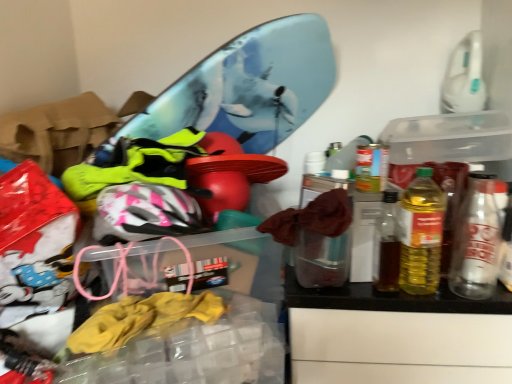
This screenshot has width=512, height=384. What are the coordinates of `yellow translucent bottle at right, marked as the 1th bottle in a left-to-right arrangement` in the screenshot? It's located at (421, 234).

What do you see at coordinates (421, 234) in the screenshot? I see `yellow translucent bottle at right, marked as the 1th bottle in a left-to-right arrangement` at bounding box center [421, 234].

In order to face metallic silver can at right, the 1th bottle positioned from the right, should I rotate leftwards or rightwards?

A 27.763 degree turn to the right will do.

You are a GUI agent. You are given a task and a screenshot of the screen. Output one action in this format:
    pyautogui.click(x=<x>, y=<y>)
    Task: Click on the metallic silver can at right, which ranks as the second bottle in left-to-right order
    The width and height of the screenshot is (512, 384).
    Given the screenshot: What is the action you would take?
    pyautogui.click(x=476, y=241)

The image size is (512, 384). What do you see at coordinates (476, 241) in the screenshot?
I see `metallic silver can at right, the 1th bottle positioned from the right` at bounding box center [476, 241].

Find the location of a particular element. This screenshot has height=384, width=512. yellow translucent bottle at right, marked as the 1th bottle in a left-to-right arrangement is located at coordinates (421, 234).

Between yellow translucent bottle at right, marked as the 1th bottle in a left-to-right arrangement, and metallic silver can at right, the 1th bottle positioned from the right, which one appears on the right side from the viewer's perspective?

Positioned to the right is metallic silver can at right, the 1th bottle positioned from the right.

In the image, is yellow translucent bottle at right, marked as the 1th bottle in a left-to-right arrangement, positioned in front of or behind metallic silver can at right, the 1th bottle positioned from the right?

yellow translucent bottle at right, marked as the 1th bottle in a left-to-right arrangement, is in front of metallic silver can at right, the 1th bottle positioned from the right.

Looking at this image, which is nearer, (409, 198) or (484, 232)?

Clearly, point (409, 198) is closer to the camera than point (484, 232).

From the image's perspective, which one is positioned higher, yellow translucent bottle at right, which is the second bottle in right-to-left order, or metallic silver can at right, which ranks as the second bottle in left-to-right order?

yellow translucent bottle at right, which is the second bottle in right-to-left order, from the image's perspective.

Based on the photo, from a real-world perspective, which object rests below the other?

metallic silver can at right, the 1th bottle positioned from the right, is physically lower.

Can you confirm if yellow translucent bottle at right, which is the second bottle in right-to-left order, is thinner than metallic silver can at right, the 1th bottle positioned from the right?

No, yellow translucent bottle at right, which is the second bottle in right-to-left order, is not thinner than metallic silver can at right, the 1th bottle positioned from the right.

From their relative heights in the image, would you say yellow translucent bottle at right, which is the second bottle in right-to-left order, is taller or shorter than metallic silver can at right, the 1th bottle positioned from the right?

Considering their sizes, yellow translucent bottle at right, which is the second bottle in right-to-left order, has more height than metallic silver can at right, the 1th bottle positioned from the right.

Considering the sizes of objects yellow translucent bottle at right, which is the second bottle in right-to-left order, and metallic silver can at right, which ranks as the second bottle in left-to-right order, in the image provided, who is smaller, yellow translucent bottle at right, which is the second bottle in right-to-left order, or metallic silver can at right, which ranks as the second bottle in left-to-right order,?

Smaller between the two is metallic silver can at right, which ranks as the second bottle in left-to-right order.

Could metallic silver can at right, which ranks as the second bottle in left-to-right order, be considered to be inside yellow translucent bottle at right, marked as the 1th bottle in a left-to-right arrangement?

Result: No, metallic silver can at right, which ranks as the second bottle in left-to-right order, is not a part of yellow translucent bottle at right, marked as the 1th bottle in a left-to-right arrangement.

Are yellow translucent bottle at right, marked as the 1th bottle in a left-to-right arrangement, and metallic silver can at right, which ranks as the second bottle in left-to-right order, located far from each other?

They are positioned close to each other.

Is yellow translucent bottle at right, marked as the 1th bottle in a left-to-right arrangement, facing away from metallic silver can at right, the 1th bottle positioned from the right?

No.

This screenshot has height=384, width=512. What are the coordinates of `bottle below the yellow translucent bottle at right, marked as the 1th bottle in a left-to-right arrangement (from the image's perspective)` in the screenshot? It's located at (476, 241).

Does metallic silver can at right, which ranks as the second bottle in left-to-right order, appear on the right side of yellow translucent bottle at right, which is the second bottle in right-to-left order?

Yes, metallic silver can at right, which ranks as the second bottle in left-to-right order, is to the right of yellow translucent bottle at right, which is the second bottle in right-to-left order.

Based on the photo, which object is more forward, metallic silver can at right, which ranks as the second bottle in left-to-right order, or yellow translucent bottle at right, which is the second bottle in right-to-left order?

yellow translucent bottle at right, which is the second bottle in right-to-left order, is more forward.

Which point is more distant from viewer, (457, 229) or (416, 216)?

The point (457, 229) is farther from the camera.

From the image's perspective, which is below, metallic silver can at right, the 1th bottle positioned from the right, or yellow translucent bottle at right, marked as the 1th bottle in a left-to-right arrangement?

metallic silver can at right, the 1th bottle positioned from the right, from the image's perspective.

From a real-world perspective, which object stands above the other?

From a 3D spatial view, yellow translucent bottle at right, marked as the 1th bottle in a left-to-right arrangement, is above.

Is metallic silver can at right, the 1th bottle positioned from the right, thinner than yellow translucent bottle at right, marked as the 1th bottle in a left-to-right arrangement?

Yes, metallic silver can at right, the 1th bottle positioned from the right, is thinner than yellow translucent bottle at right, marked as the 1th bottle in a left-to-right arrangement.

Considering the relative sizes of metallic silver can at right, the 1th bottle positioned from the right, and yellow translucent bottle at right, marked as the 1th bottle in a left-to-right arrangement, in the image provided, is metallic silver can at right, the 1th bottle positioned from the right, shorter than yellow translucent bottle at right, marked as the 1th bottle in a left-to-right arrangement,?

Yes, metallic silver can at right, the 1th bottle positioned from the right, is shorter than yellow translucent bottle at right, marked as the 1th bottle in a left-to-right arrangement.

Considering the sizes of metallic silver can at right, which ranks as the second bottle in left-to-right order, and yellow translucent bottle at right, which is the second bottle in right-to-left order, in the image, is metallic silver can at right, which ranks as the second bottle in left-to-right order, bigger or smaller than yellow translucent bottle at right, which is the second bottle in right-to-left order,?

metallic silver can at right, which ranks as the second bottle in left-to-right order, is smaller than yellow translucent bottle at right, which is the second bottle in right-to-left order.

Is metallic silver can at right, which ranks as the second bottle in left-to-right order, completely or partially outside of yellow translucent bottle at right, which is the second bottle in right-to-left order?

Yes, metallic silver can at right, which ranks as the second bottle in left-to-right order, is located beyond the bounds of yellow translucent bottle at right, which is the second bottle in right-to-left order.

Can you see metallic silver can at right, which ranks as the second bottle in left-to-right order, touching yellow translucent bottle at right, marked as the 1th bottle in a left-to-right arrangement?

Yes, the surface of metallic silver can at right, which ranks as the second bottle in left-to-right order, is in contact with yellow translucent bottle at right, marked as the 1th bottle in a left-to-right arrangement.

Consider the image. Is metallic silver can at right, the 1th bottle positioned from the right, looking in the opposite direction of yellow translucent bottle at right, which is the second bottle in right-to-left order?

No, metallic silver can at right, the 1th bottle positioned from the right, is not facing away from yellow translucent bottle at right, which is the second bottle in right-to-left order.

How much distance is there between metallic silver can at right, the 1th bottle positioned from the right, and yellow translucent bottle at right, which is the second bottle in right-to-left order?

The distance of metallic silver can at right, the 1th bottle positioned from the right, from yellow translucent bottle at right, which is the second bottle in right-to-left order, is 3.50 inches.

Locate an element on the screen. Image resolution: width=512 pixels, height=384 pixels. bottle lying above the metallic silver can at right, the 1th bottle positioned from the right (from the image's perspective) is located at coordinates (421, 234).

You are a GUI agent. You are given a task and a screenshot of the screen. Output one action in this format:
    pyautogui.click(x=<x>, y=<y>)
    Task: Click on the bottle below the yellow translucent bottle at right, marked as the 1th bottle in a left-to-right arrangement (from a real-world perspective)
    Image resolution: width=512 pixels, height=384 pixels.
    Given the screenshot: What is the action you would take?
    pyautogui.click(x=476, y=241)

The height and width of the screenshot is (384, 512). Identify the location of bottle lying in front of the metallic silver can at right, the 1th bottle positioned from the right. (421, 234).